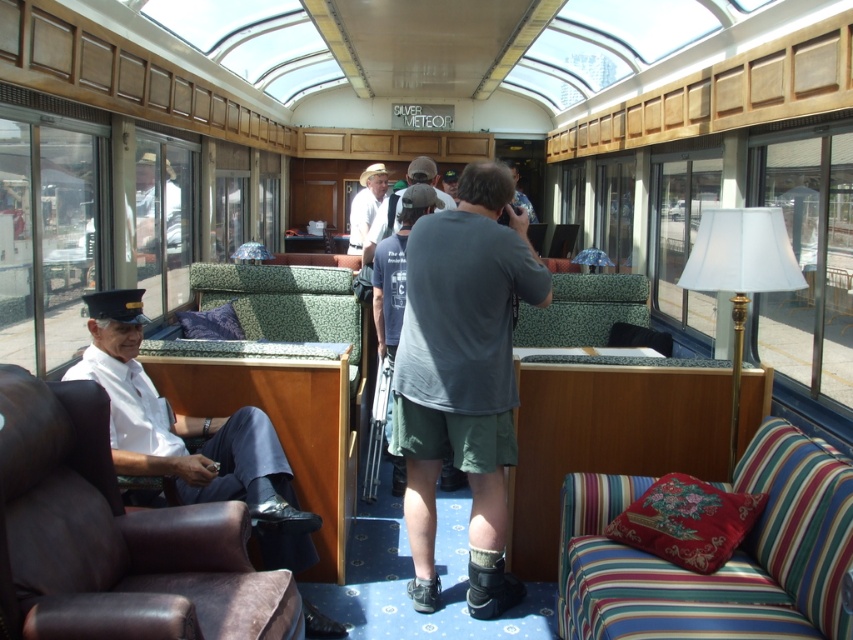
Does dark gray cotton t-shirt at center have a larger size compared to white shirt at center?

No.

Who is taller, dark gray cotton t-shirt at center or white shirt at center?

With more height is dark gray cotton t-shirt at center.

Which is behind, point (418, 388) or point (367, 248)?

Positioned behind is point (367, 248).

Find the location of a particular element. dark gray cotton t-shirt at center is located at coordinates (463, 376).

Can you confirm if dark gray cotton t-shirt at center is positioned below matte white shirt at center?

Yes.

Find the location of a particular element. dark gray cotton t-shirt at center is located at coordinates (463, 376).

Locate an element on the screen. dark gray cotton t-shirt at center is located at coordinates (463, 376).

Can you confirm if green floral fabric couch at center is positioned below white shirt at center?

Yes, green floral fabric couch at center is below white shirt at center.

Is green floral fabric couch at center above white shirt at center?

No.

Does point (590, 300) come behind point (419, 157)?

Yes, it is behind point (419, 157).

You are a GUI agent. You are given a task and a screenshot of the screen. Output one action in this format:
    pyautogui.click(x=<x>, y=<y>)
    Task: Click on the green floral fabric couch at center
    Image resolution: width=853 pixels, height=640 pixels.
    Given the screenshot: What is the action you would take?
    pyautogui.click(x=583, y=310)